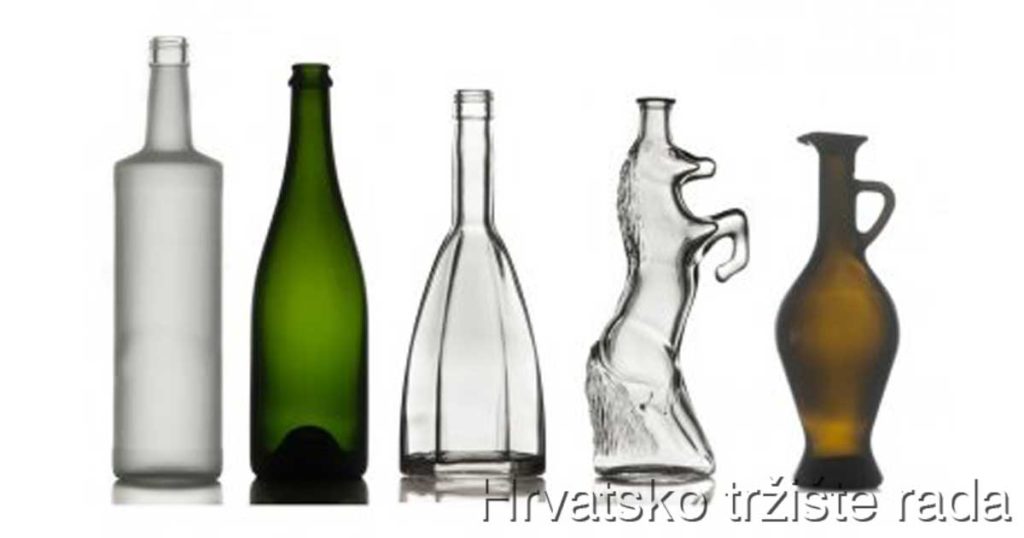
Find the location of a particular element. Image resolution: width=1024 pixels, height=538 pixels. decorative bottles is located at coordinates (172, 294), (288, 312), (457, 320), (644, 309), (836, 335).